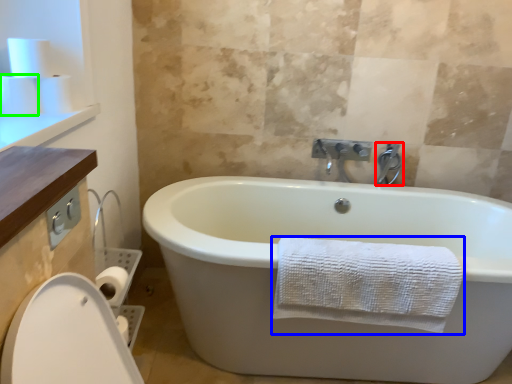
Question: Which is nearer to the tap (highlighted by a red box)? towel (highlighted by a blue box) or toilet paper (highlighted by a green box).

Choices:
 (A) towel
 (B) toilet paper

Answer: (A)